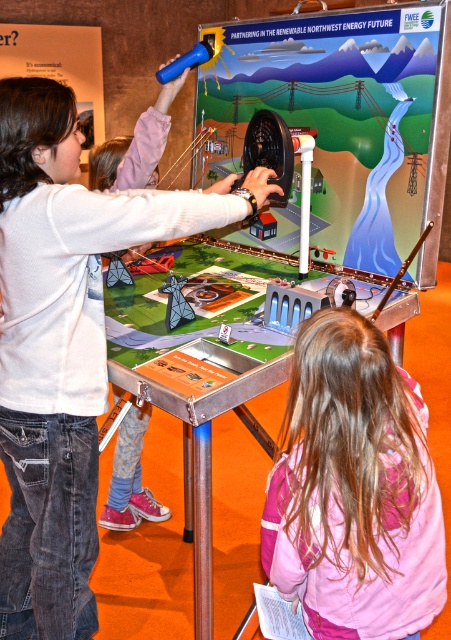
Question: Which object is closer to the camera taking this photo?

Choices:
 (A) matte white shirt at upper left
 (B) pink fabric hair at upper center
 (C) white matte shirt at upper left

Answer: (B)

Question: Which of the following is the farthest from the observer?

Choices:
 (A) white matte shirt at upper left
 (B) pink fabric hair at upper center
 (C) matte white shirt at upper left

Answer: (C)

Question: In this image, where is white matte shirt at upper left located relative to matte white shirt at upper left?

Choices:
 (A) right
 (B) left

Answer: (B)

Question: In this image, where is pink fabric hair at upper center located relative to matte white shirt at upper left?

Choices:
 (A) below
 (B) above

Answer: (A)

Question: Does pink fabric hair at upper center have a greater width compared to matte white shirt at upper left?

Choices:
 (A) no
 (B) yes

Answer: (A)

Question: Which of the following is the farthest from the observer?

Choices:
 (A) [x=344, y=348]
 (B) [x=137, y=486]

Answer: (B)